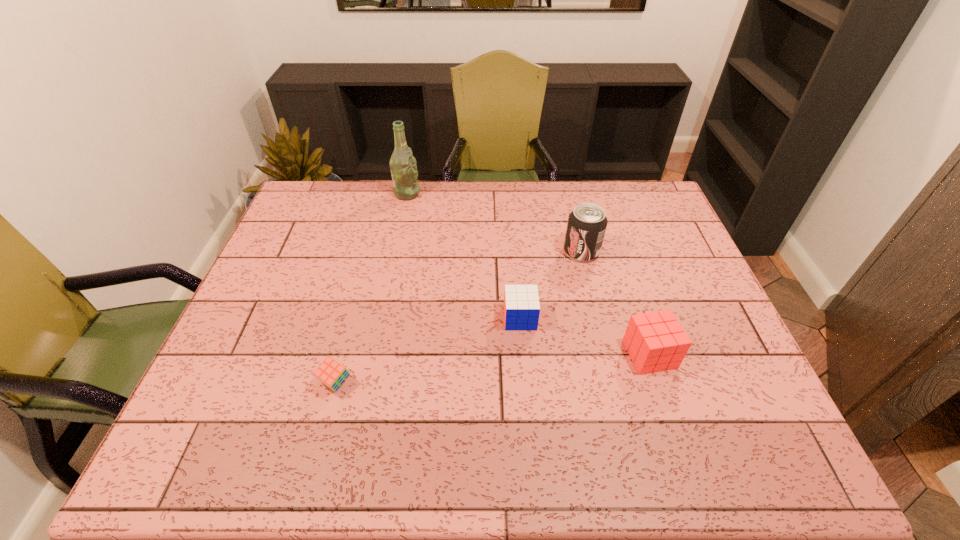
Identify the location of free space at the right edge of the desktop. (660, 254).

The width and height of the screenshot is (960, 540). In order to click on blank space at the far left corner of the desktop in this screenshot , I will do `click(334, 198)`.

The height and width of the screenshot is (540, 960). I want to click on free space at the far right corner, so click(x=655, y=202).

Identify the location of vacant space that is in between the beer bottle and the tallest cube. (528, 274).

Locate an element on the screen. This screenshot has width=960, height=540. free spot between the second cube from left to right and the beer bottle is located at coordinates (464, 256).

Locate an element on the screen. free point between the third farthest object and the third shortest object is located at coordinates (585, 336).

Find the location of a particular element. The image size is (960, 540). unoccupied area between the shortest cube and the beer bottle is located at coordinates (372, 288).

I want to click on vacant point located between the shortest cube and the rightmost cube, so click(492, 368).

At what (x,y) coordinates should I click in order to perform the action: click on free spot between the second cube from right to left and the soda can. Please return your answer as a coordinate pair (x, y). Looking at the image, I should click on point(551,285).

Locate an element on the screen. The width and height of the screenshot is (960, 540). vacant point located between the third farthest object and the shortest object is located at coordinates (428, 350).